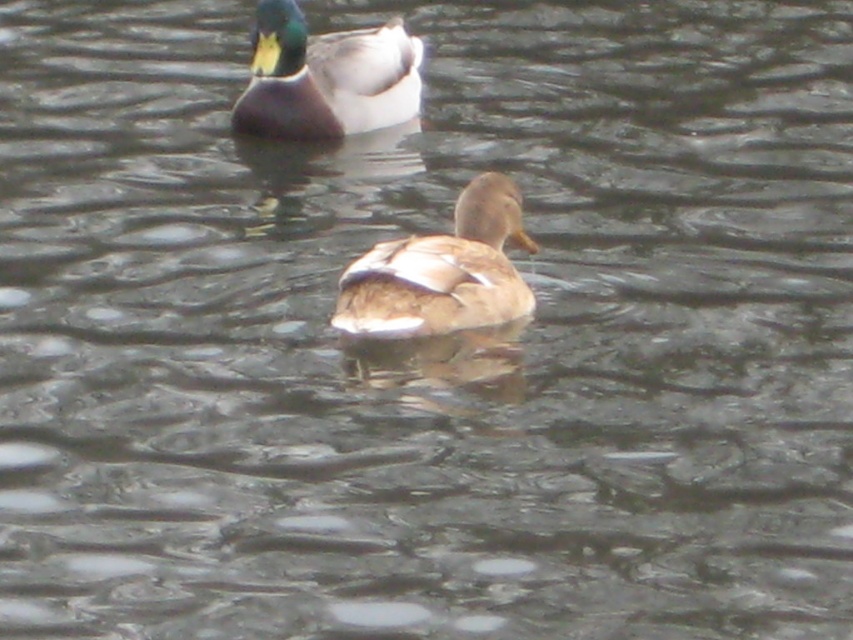
Question: Among these objects, which one is farthest from the camera?

Choices:
 (A) shiny green and brown duck at upper center
 (B) brown matte duck at center

Answer: (A)

Question: Is brown matte duck at center wider than shiny green and brown duck at upper center?

Choices:
 (A) no
 (B) yes

Answer: (A)

Question: Is brown matte duck at center bigger than shiny green and brown duck at upper center?

Choices:
 (A) yes
 (B) no

Answer: (B)

Question: Which point appears farthest from the camera in this image?

Choices:
 (A) (498, 243)
 (B) (404, 77)

Answer: (B)

Question: Does brown matte duck at center appear on the left side of shiny green and brown duck at upper center?

Choices:
 (A) no
 (B) yes

Answer: (A)